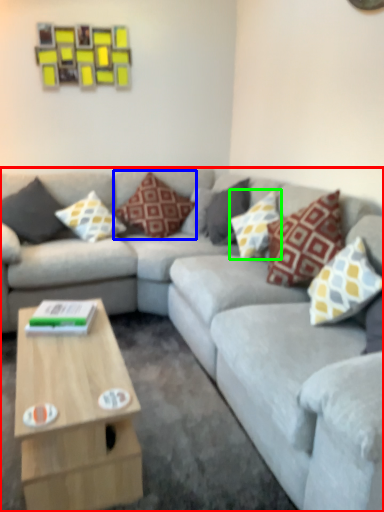
Question: Which is nearer to the studio couch (highlighted by a red box)? pillow (highlighted by a blue box) or pillow (highlighted by a green box).

Choices:
 (A) pillow
 (B) pillow

Answer: (B)